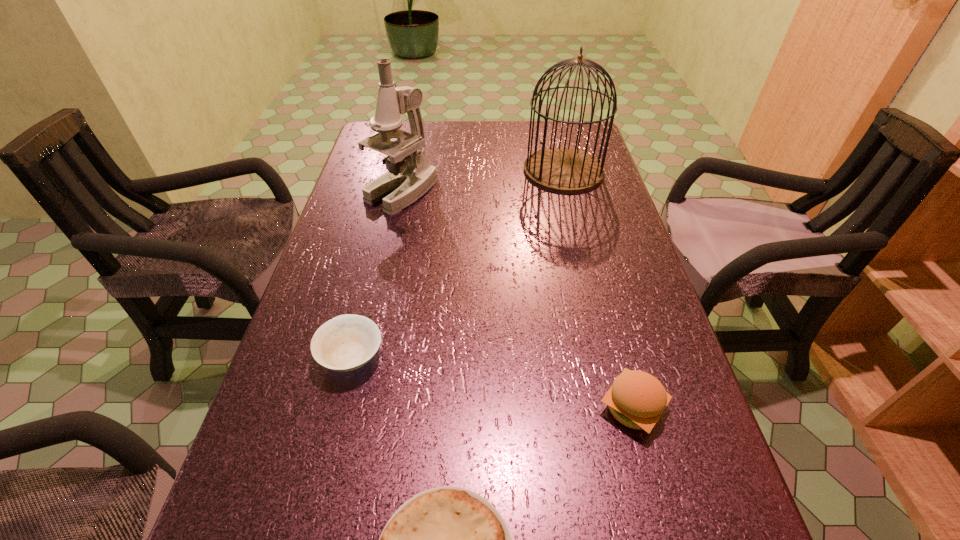
Locate an element on the screen. The width and height of the screenshot is (960, 540). bowl that is at the left edge is located at coordinates (347, 342).

The width and height of the screenshot is (960, 540). Identify the location of birdcage that is at the right edge. (565, 170).

Where is `hamburger located in the right edge section of the desktop`? This screenshot has width=960, height=540. hamburger located in the right edge section of the desktop is located at coordinates (636, 399).

Find the location of `object that is at the far right corner`. object that is at the far right corner is located at coordinates (565, 170).

This screenshot has height=540, width=960. Identify the location of free region at the far edge of the desktop. (487, 130).

This screenshot has width=960, height=540. In the image, there is a desktop. In order to click on blank space at the left edge in this screenshot , I will do `click(319, 262)`.

Find the location of a particular element. vacant space at the right edge of the desktop is located at coordinates (608, 350).

This screenshot has height=540, width=960. I want to click on free space that is in between the microscope and the birdcage, so pyautogui.click(x=483, y=181).

Find the location of a particular element. The width and height of the screenshot is (960, 540). unoccupied area between the birdcage and the hamburger is located at coordinates pyautogui.click(x=598, y=289).

Locate an element on the screen. Image resolution: width=960 pixels, height=540 pixels. vacant area between the microscope and the birdcage is located at coordinates (483, 181).